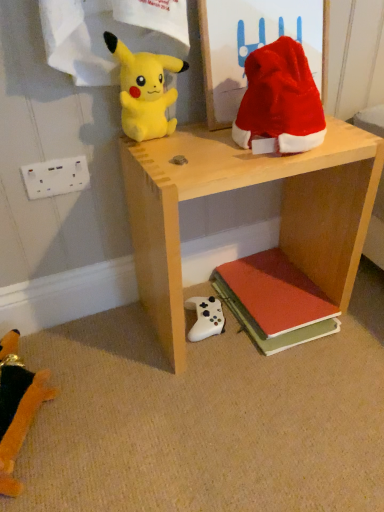
Find the location of a particular element. vacant area to the right of velvet orange stuffed toy at lower left, which ranks as the 1th toy in bottom-to-top order is located at coordinates coord(124,403).